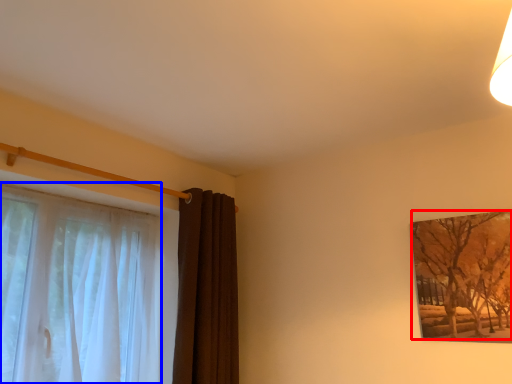
Question: Among these objects, which one is farthest to the camera, tree (highlighted by a red box) or curtain (highlighted by a blue box)?

Choices:
 (A) tree
 (B) curtain

Answer: (A)